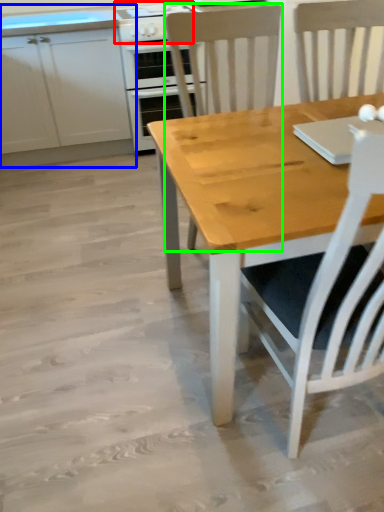
Question: Which object is the closest to the gas stove (highlighted by a red box)? Choose among these: cabinetry (highlighted by a blue box) or chair (highlighted by a green box).

Choices:
 (A) cabinetry
 (B) chair

Answer: (B)